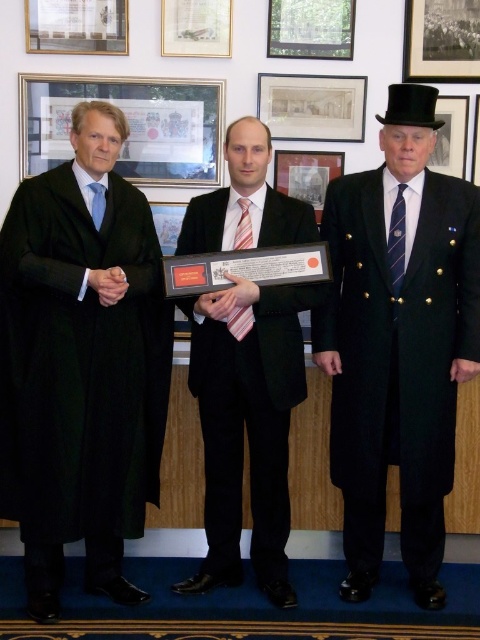
Does black wool coat at right appear on the left side of matte paper picture frame at upper center?

Incorrect, black wool coat at right is not on the left side of matte paper picture frame at upper center.

Is black wool coat at right further to the viewer compared to matte paper picture frame at upper center?

No, black wool coat at right is in front of matte paper picture frame at upper center.

Is point (391, 115) positioned behind point (342, 90)?

No, (391, 115) is closer to viewer.

This screenshot has width=480, height=640. Find the location of `black wool coat at right`. black wool coat at right is located at coordinates (397, 340).

Is black woolen robe at left thinner than matte glass picture frame at upper left?

Yes.

Based on the photo, is the position of black woolen robe at left less distant than that of matte glass picture frame at upper left?

Yes.

Measure the distance between point [64,460] and camera.

Point [64,460] is 2.36 meters away from camera.

Where is `black woolen robe at left`? black woolen robe at left is located at coordinates (82, 364).

Where is `matte glass picture frame at upper left`? The width and height of the screenshot is (480, 640). matte glass picture frame at upper left is located at coordinates (129, 124).